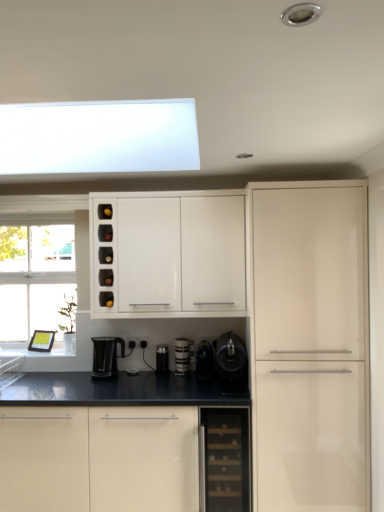
Question: From the image's perspective, is black plastic coffee maker at center, the 3th appliance in the left-to-right sequence, beneath white glossy coffee cup at center, acting as the second appliance starting from the left?

Choices:
 (A) yes
 (B) no

Answer: (B)

Question: Is white glossy coffee cup at center, acting as the second appliance starting from the left, inside black plastic coffee maker at center, which is counted as the second appliance, starting from the right?

Choices:
 (A) yes
 (B) no

Answer: (B)

Question: Does black plastic coffee maker at center, which is counted as the second appliance, starting from the right, have a greater height compared to white glossy coffee cup at center, positioned as the third appliance in right-to-left order?

Choices:
 (A) yes
 (B) no

Answer: (B)

Question: From a real-world perspective, is black plastic coffee maker at center, which is counted as the second appliance, starting from the right, located beneath white glossy coffee cup at center, positioned as the third appliance in right-to-left order?

Choices:
 (A) yes
 (B) no

Answer: (B)

Question: Are black plastic coffee maker at center, the 3th appliance in the left-to-right sequence, and white glossy coffee cup at center, acting as the second appliance starting from the left, located far from each other?

Choices:
 (A) yes
 (B) no

Answer: (B)

Question: Does black plastic coffee maker at center, the 3th appliance in the left-to-right sequence, appear on the left side of white glossy coffee cup at center, positioned as the third appliance in right-to-left order?

Choices:
 (A) yes
 (B) no

Answer: (B)

Question: Is black plastic kettle at lower center in contact with matte black coffee maker at center, acting as the fourth appliance starting from the right?

Choices:
 (A) no
 (B) yes

Answer: (A)

Question: Does black plastic kettle at lower center have a lesser height compared to matte black coffee maker at center, acting as the fourth appliance starting from the right?

Choices:
 (A) yes
 (B) no

Answer: (B)

Question: Is black plastic kettle at lower center smaller than matte black coffee maker at center, acting as the fourth appliance starting from the right?

Choices:
 (A) no
 (B) yes

Answer: (A)

Question: Can you confirm if black plastic kettle at lower center is wider than matte black coffee maker at center, which is counted as the first appliance, starting from the left?

Choices:
 (A) yes
 (B) no

Answer: (A)

Question: From a real-world perspective, is black plastic kettle at lower center positioned over matte black coffee maker at center, acting as the fourth appliance starting from the right, based on gravity?

Choices:
 (A) no
 (B) yes

Answer: (B)

Question: Is black plastic kettle at lower center turned away from matte black coffee maker at center, which is counted as the first appliance, starting from the left?

Choices:
 (A) yes
 (B) no

Answer: (B)

Question: Is black glass dishwasher at lower center bigger than black plastic kettle at lower center?

Choices:
 (A) yes
 (B) no

Answer: (A)